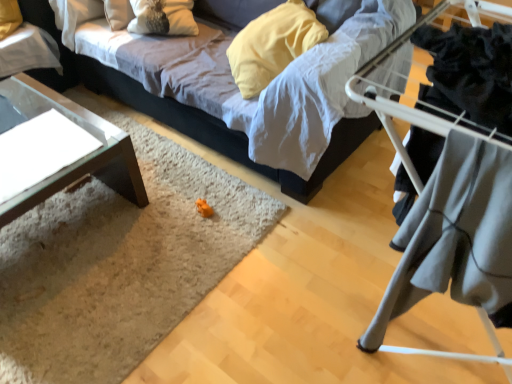
This screenshot has height=384, width=512. I want to click on velvet fabric couch at center, so (x=207, y=102).

Locate an element on the screen. gray fabric at right is located at coordinates (411, 108).

What is the approximate width of transparent glass table at lower left, which is the 1th table in bottom-to-top order?

27.49 inches.

You are a GUI agent. You are given a task and a screenshot of the screen. Output one action in this format:
    pyautogui.click(x=<x>, y=<y>)
    Task: Click on the velvet fabric couch at center
    Image resolution: width=512 pixels, height=384 pixels.
    Given the screenshot: What is the action you would take?
    pyautogui.click(x=207, y=102)

Can you confirm if velvet fabric couch at center is thinner than gray fabric at right?

Incorrect, the width of velvet fabric couch at center is not less than that of gray fabric at right.

From the picture: Does velvet fabric couch at center turn towards gray fabric at right?

No.

How different are the orientations of velvet fabric couch at center and gray fabric at right in degrees?

0.29 degrees.

Is transparent glass table at lower left, which is the second table from top to bottom, bigger than clear glass table at upper left, the second table positioned from the bottom?

Indeed, transparent glass table at lower left, which is the second table from top to bottom, has a larger size compared to clear glass table at upper left, the second table positioned from the bottom.

Would you say transparent glass table at lower left, which is the 1th table in bottom-to-top order, is outside clear glass table at upper left, the second table positioned from the bottom?

That's correct, transparent glass table at lower left, which is the 1th table in bottom-to-top order, is outside of clear glass table at upper left, the second table positioned from the bottom.

At what (x,y) coordinates should I click in order to perform the action: click on table located behind the transparent glass table at lower left, which is the 1th table in bottom-to-top order. Please return your answer as a coordinate pair (x, y). The image size is (512, 384). Looking at the image, I should click on (28, 51).

Does point (112, 187) appear closer or farther from the camera than point (39, 64)?

Point (112, 187) is closer to the camera than point (39, 64).

Can you confirm if gray fabric at right is taller than velvet fabric couch at center?

Incorrect, the height of gray fabric at right is not larger of that of velvet fabric couch at center.

Can we say gray fabric at right lies outside velvet fabric couch at center?

Yes.

Is gray fabric at right touching velvet fabric couch at center?

No, gray fabric at right is not next to velvet fabric couch at center.

Is gray fabric at right oriented away from velvet fabric couch at center?

No, velvet fabric couch at center is not at the back of gray fabric at right.

Which of these two, clear glass table at upper left, the second table positioned from the bottom, or gray fabric at right, is thinner?

gray fabric at right.

Does point (7, 52) come behind point (481, 360)?

Yes, point (7, 52) is farther from viewer.

Considering the sizes of objects clear glass table at upper left, the second table positioned from the bottom, and gray fabric at right in the image provided, who is bigger, clear glass table at upper left, the second table positioned from the bottom, or gray fabric at right?

clear glass table at upper left, the second table positioned from the bottom, is bigger.

Is clear glass table at upper left, the second table positioned from the bottom, positioned with its back to transparent glass table at lower left, which is the 1th table in bottom-to-top order?

clear glass table at upper left, the second table positioned from the bottom, is not turned away from transparent glass table at lower left, which is the 1th table in bottom-to-top order.

Which object is thinner, clear glass table at upper left, arranged as the 1th table when viewed from the top, or transparent glass table at lower left, which is the 1th table in bottom-to-top order?

Thinner between the two is clear glass table at upper left, arranged as the 1th table when viewed from the top.

From the image's perspective, between clear glass table at upper left, arranged as the 1th table when viewed from the top, and transparent glass table at lower left, which is the second table from top to bottom, which one is located above?

From the image's view, clear glass table at upper left, arranged as the 1th table when viewed from the top, is above.

Does point (358, 116) appear closer or farther from the camera than point (106, 125)?

Point (358, 116) appears to be farther away from the viewer than point (106, 125).

Is velvet fabric couch at center located outside transparent glass table at lower left, which is the 1th table in bottom-to-top order?

Yes, velvet fabric couch at center is located beyond the bounds of transparent glass table at lower left, which is the 1th table in bottom-to-top order.

Can you tell me how much velvet fabric couch at center and transparent glass table at lower left, which is the second table from top to bottom, differ in facing direction?

The angle between the facing direction of velvet fabric couch at center and the facing direction of transparent glass table at lower left, which is the second table from top to bottom, is 0.000113 degrees.

Is velvet fabric couch at center shorter than transparent glass table at lower left, which is the 1th table in bottom-to-top order?

No, velvet fabric couch at center is not shorter than transparent glass table at lower left, which is the 1th table in bottom-to-top order.

Is point (324, 156) behind point (55, 61)?

No, (324, 156) is closer to viewer.

Is velvet fabric couch at center behind clear glass table at upper left, the second table positioned from the bottom?

No, it is in front of clear glass table at upper left, the second table positioned from the bottom.

Can you confirm if velvet fabric couch at center is positioned to the left of clear glass table at upper left, arranged as the 1th table when viewed from the top?

No.

From a real-world perspective, is velvet fabric couch at center physically above clear glass table at upper left, arranged as the 1th table when viewed from the top?

Yes, from a real-world perspective, velvet fabric couch at center is on top of clear glass table at upper left, arranged as the 1th table when viewed from the top.

Image resolution: width=512 pixels, height=384 pixels. Identify the location of studio couch above the gray fabric at right (from the image's perspective). (207, 102).

Image resolution: width=512 pixels, height=384 pixels. Identify the location of table that is behind the transparent glass table at lower left, which is the 1th table in bottom-to-top order. (28, 51).

Estimate the real-world distances between objects in this image. Which object is further from clear glass table at upper left, the second table positioned from the bottom, velvet fabric couch at center or transparent glass table at lower left, which is the 1th table in bottom-to-top order?

velvet fabric couch at center lies further to clear glass table at upper left, the second table positioned from the bottom, than the other object.

In the scene shown: Looking at the image, which one is located closer to transparent glass table at lower left, which is the 1th table in bottom-to-top order, clear glass table at upper left, the second table positioned from the bottom, or velvet fabric couch at center?

clear glass table at upper left, the second table positioned from the bottom, is closer to transparent glass table at lower left, which is the 1th table in bottom-to-top order.

In the scene shown: When comparing their distances from gray fabric at right, does transparent glass table at lower left, which is the 1th table in bottom-to-top order, or clear glass table at upper left, arranged as the 1th table when viewed from the top, seem further?

The object further to gray fabric at right is clear glass table at upper left, arranged as the 1th table when viewed from the top.

Considering their positions, is velvet fabric couch at center positioned further to gray fabric at right than clear glass table at upper left, the second table positioned from the bottom?

The object further to gray fabric at right is clear glass table at upper left, the second table positioned from the bottom.

From the image, which object appears to be farther from clear glass table at upper left, arranged as the 1th table when viewed from the top, transparent glass table at lower left, which is the 1th table in bottom-to-top order, or velvet fabric couch at center?

velvet fabric couch at center.

Based on their spatial positions, is transparent glass table at lower left, which is the 1th table in bottom-to-top order, or clear glass table at upper left, the second table positioned from the bottom, closer to velvet fabric couch at center?

Among the two, transparent glass table at lower left, which is the 1th table in bottom-to-top order, is located nearer to velvet fabric couch at center.

Based on their spatial positions, is velvet fabric couch at center or transparent glass table at lower left, which is the second table from top to bottom, closer to gray fabric at right?

Among the two, velvet fabric couch at center is located nearer to gray fabric at right.

Considering their positions, is gray fabric at right positioned closer to transparent glass table at lower left, which is the 1th table in bottom-to-top order, than velvet fabric couch at center?

velvet fabric couch at center is closer to transparent glass table at lower left, which is the 1th table in bottom-to-top order.

Identify the location of table between clear glass table at upper left, the second table positioned from the bottom, and velvet fabric couch at center, in the horizontal direction. This screenshot has width=512, height=384. (81, 158).

You are a GUI agent. You are given a task and a screenshot of the screen. Output one action in this format:
    pyautogui.click(x=<x>, y=<y>)
    Task: Click on the table between clear glass table at upper left, the second table positioned from the bottom, and gray fabric at right
    
    Given the screenshot: What is the action you would take?
    pyautogui.click(x=81, y=158)

Locate an element on the screen. This screenshot has width=512, height=384. studio couch located between transparent glass table at lower left, which is the 1th table in bottom-to-top order, and gray fabric at right in the left-right direction is located at coordinates (207, 102).

Identify the location of studio couch located between clear glass table at upper left, arranged as the 1th table when viewed from the top, and gray fabric at right in the left-right direction. (207, 102).